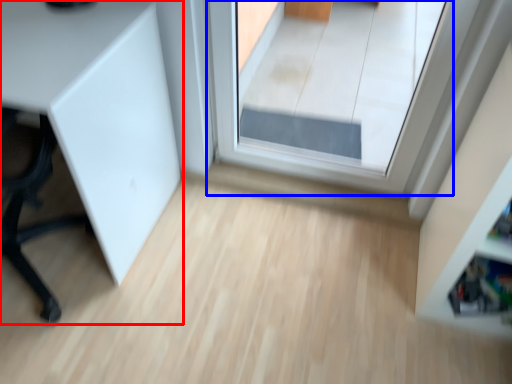
Question: Which object appears farthest to the camera in this image, furniture (highlighted by a red box) or window (highlighted by a blue box)?

Choices:
 (A) furniture
 (B) window

Answer: (B)